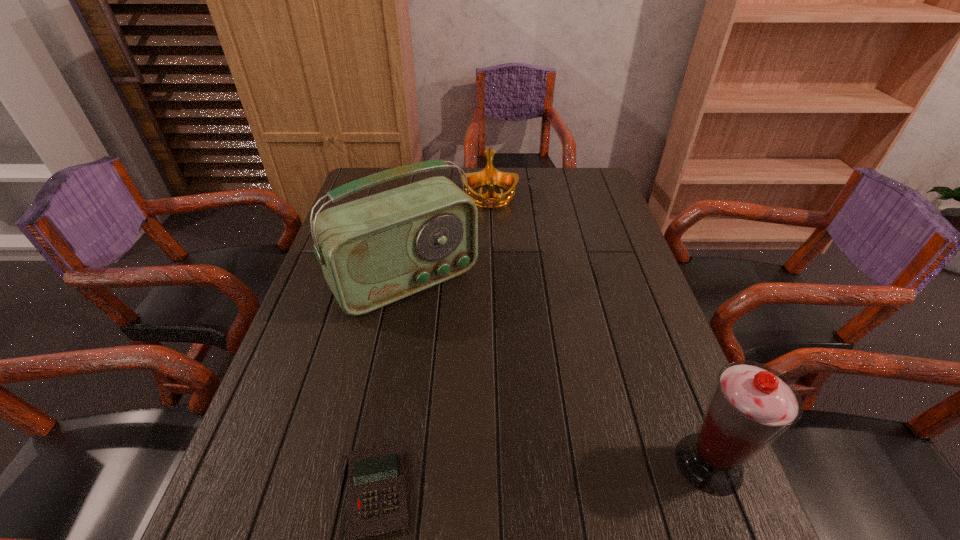
Identify the location of free spot at the far left corner of the desktop. The height and width of the screenshot is (540, 960). (388, 168).

Identify the location of vacant point located between the radio receiver and the smoothie. (558, 372).

Locate an element on the screen. The width and height of the screenshot is (960, 540). vacant point located between the third tallest object and the rightmost object is located at coordinates (600, 330).

Where is `empty space that is in between the radio receiver and the rightmost object`? empty space that is in between the radio receiver and the rightmost object is located at coordinates (558, 372).

Locate which object is the third closest to the farthest object. Please provide its 2D coordinates. Your answer should be formatted as a tuple, i.e. [(x, y)], where the tuple contains the x and y coordinates of a point satisfying the conditions above.

[(751, 405)]

Find the location of a particular element. object that is the closest to the calculator is located at coordinates (374, 251).

Where is `vacant region that satisfies the following two spatial constraints: 1. on the front side of the farthest object; 2. on the right side of the rightmost object`? vacant region that satisfies the following two spatial constraints: 1. on the front side of the farthest object; 2. on the right side of the rightmost object is located at coordinates (498, 463).

Where is `vacant region that satisfies the following two spatial constraints: 1. on the back side of the tiara; 2. on the right side of the radio receiver`? Image resolution: width=960 pixels, height=540 pixels. vacant region that satisfies the following two spatial constraints: 1. on the back side of the tiara; 2. on the right side of the radio receiver is located at coordinates (421, 197).

Locate an element on the screen. vacant space that satisfies the following two spatial constraints: 1. on the back side of the second shortest object; 2. on the right side of the second farthest object is located at coordinates (421, 197).